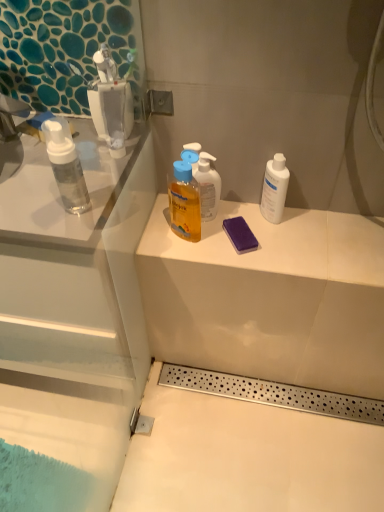
Find the location of `vacant region to the right of purple sponge at center`. vacant region to the right of purple sponge at center is located at coordinates (306, 241).